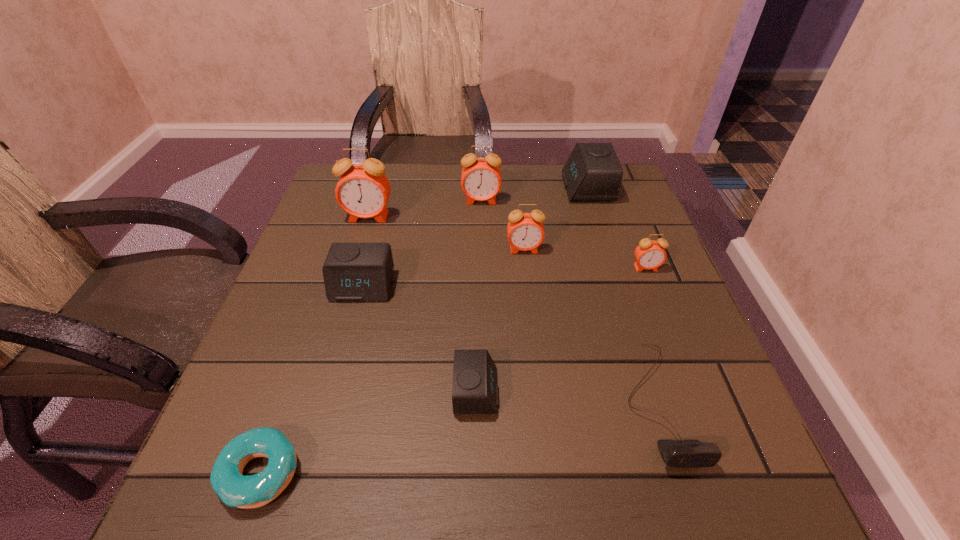
Locate an element on the screen. Image resolution: width=960 pixels, height=540 pixels. object that is at the far left corner is located at coordinates (363, 190).

Locate an element on the screen. Image resolution: width=960 pixels, height=540 pixels. object located at the near left corner is located at coordinates (234, 489).

Where is `object positioned at the far right corner`? object positioned at the far right corner is located at coordinates (593, 172).

Find the location of `object that is positioned at the near right corner`. object that is positioned at the near right corner is located at coordinates (676, 453).

Find the location of a particular element. This screenshot has height=540, width=960. vacant space at the far edge is located at coordinates (413, 168).

Where is `vacant space at the near edge of the desktop`? Image resolution: width=960 pixels, height=540 pixels. vacant space at the near edge of the desktop is located at coordinates (562, 519).

This screenshot has width=960, height=540. Find the location of `blank space at the left edge of the desktop`. blank space at the left edge of the desktop is located at coordinates (314, 267).

Image resolution: width=960 pixels, height=540 pixels. Identify the location of vacant space at the right edge of the desktop. (639, 382).

Locate an element on the screen. The height and width of the screenshot is (540, 960). free space at the far left corner of the desktop is located at coordinates (340, 212).

Identify the location of vacant space at the near left corner. (202, 518).